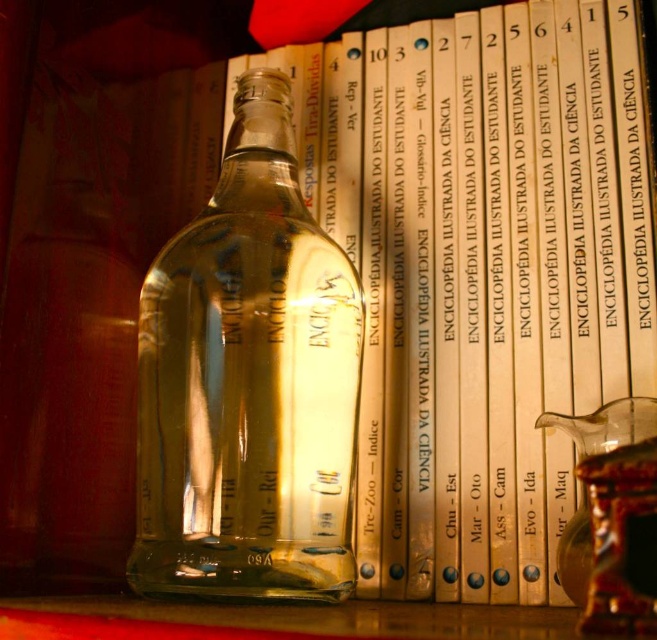
At what (x,y) coordinates should I click in order to perform the action: click on transparent glass bottle at center. Please return your answer as a coordinate pair (x, y). Looking at the image, I should click on (248, 381).

Which is behind, point (202, 211) or point (639, 396)?

The point (202, 211) is more distant.

Between point (286, 291) and point (616, 417), which one is positioned in front?

Point (616, 417) is more forward.

This screenshot has height=640, width=657. What are the coordinates of `transparent glass bottle at center` in the screenshot? It's located at (248, 381).